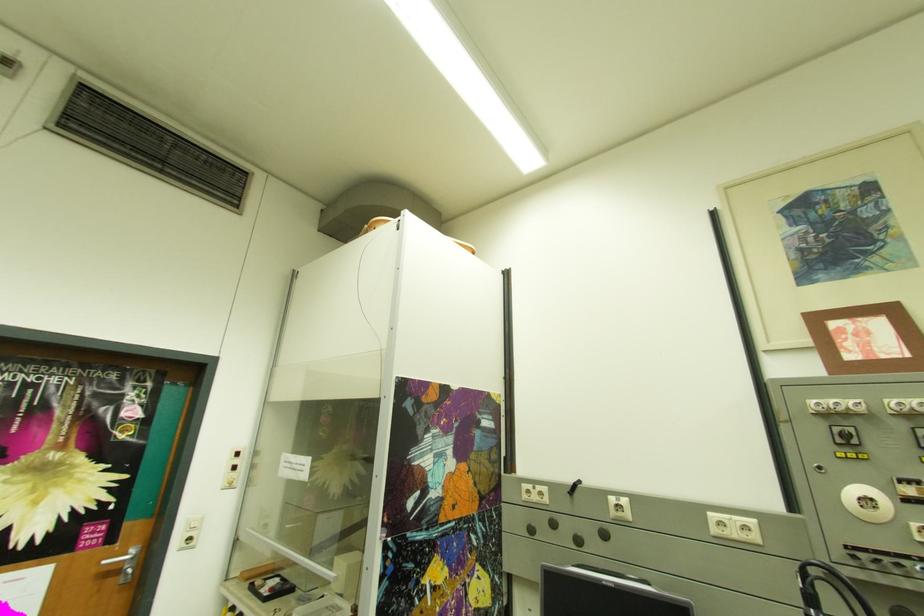
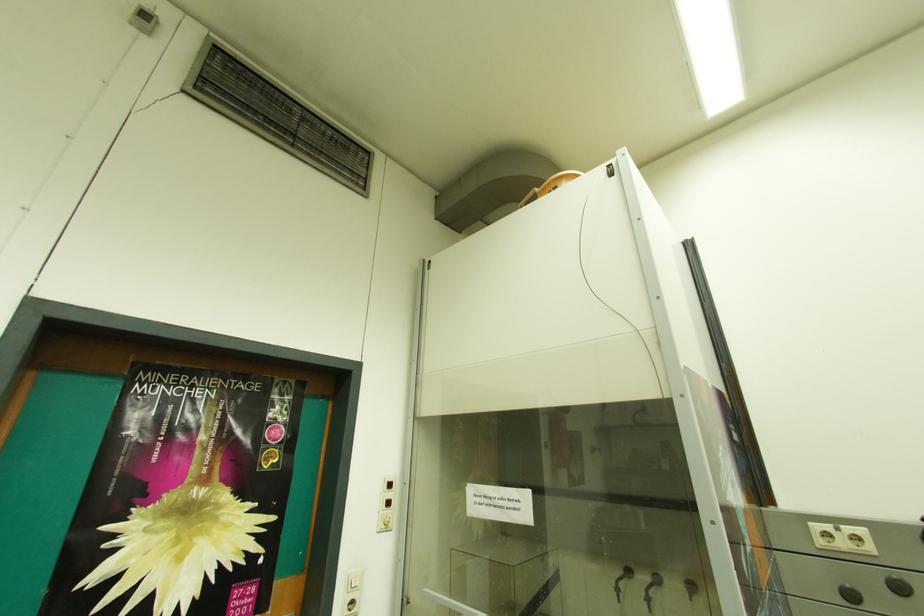
The point at (197, 541) is marked in the first image. Where is the corresponding point in the second image?

(359, 605)